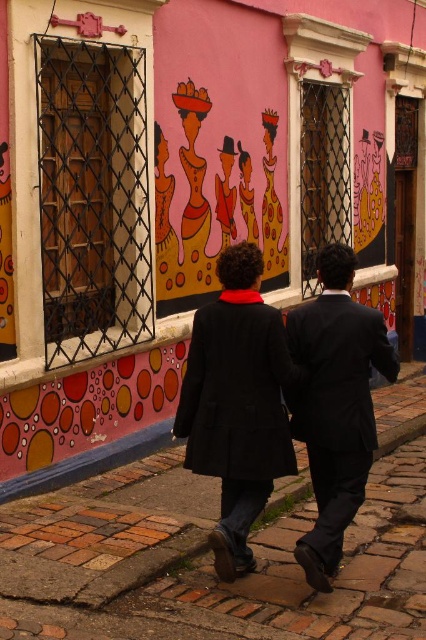
You are a photographer positioned at the end of the cobblestone path. You want to take a photo of the dark blue suit at center and the matte pink dress at center. Which one should you focus on first if you want to capture them from left to right in the frame?

You should focus on the matte pink dress at center first because it is positioned to the left of the dark blue suit at center, so capturing them from left to right would start with the matte pink dress at center followed by the dark blue suit at center.

You are a photographer standing at the end of the cobblestone path. You want to capture both the dark blue suit at center and the matte pink dress at center in a single frame. Which person should you focus on first to ensure both are in the frame?

You should focus on the dark blue suit at center first because it is larger and will be more visible in the frame, ensuring both the dark blue suit at center and the matte pink dress at center are captured.

You are standing on the cobblestone path in the street scene and notice two points marked on the colorful wall. The first point is at coordinates point [221,234] and the second is at point [245,173]. Which point appears closer to you?

Point [221,234] is closer to the viewer than point [245,173].